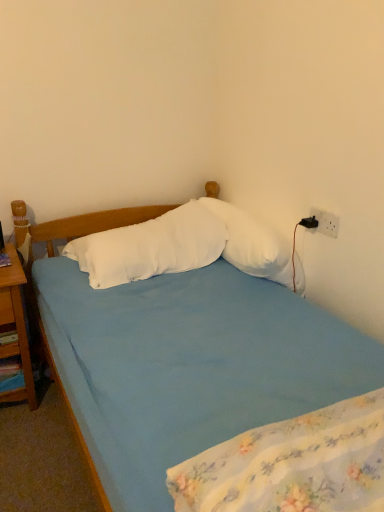
Question: Is white soft pillow at center, the first pillow in the right-to-left sequence, next to blue fabric mattress at lower center?

Choices:
 (A) no
 (B) yes

Answer: (A)

Question: Is white soft pillow at center, which is counted as the 2th pillow, starting from the left, further to camera compared to blue fabric mattress at lower center?

Choices:
 (A) no
 (B) yes

Answer: (B)

Question: Are white soft pillow at center, the first pillow in the right-to-left sequence, and blue fabric mattress at lower center located far from each other?

Choices:
 (A) yes
 (B) no

Answer: (B)

Question: Does white soft pillow at center, the first pillow in the right-to-left sequence, have a lesser width compared to blue fabric mattress at lower center?

Choices:
 (A) yes
 (B) no

Answer: (A)

Question: Is white soft pillow at center, which is counted as the 2th pillow, starting from the left, at the left side of blue fabric mattress at lower center?

Choices:
 (A) no
 (B) yes

Answer: (B)

Question: In terms of width, does white soft pillow at center, which ranks as the first pillow in left-to-right order, look wider or thinner when compared to white soft pillow at center, which is counted as the 2th pillow, starting from the left?

Choices:
 (A) thin
 (B) wide

Answer: (B)

Question: Do you think white soft pillow at center, arranged as the 2th pillow when viewed from the right, is within white soft pillow at center, which is counted as the 2th pillow, starting from the left, or outside of it?

Choices:
 (A) outside
 (B) inside

Answer: (A)

Question: In terms of height, does white soft pillow at center, which ranks as the first pillow in left-to-right order, look taller or shorter compared to white soft pillow at center, the first pillow in the right-to-left sequence?

Choices:
 (A) tall
 (B) short

Answer: (B)

Question: Based on their sizes in the image, would you say white soft pillow at center, which ranks as the first pillow in left-to-right order, is bigger or smaller than white soft pillow at center, the first pillow in the right-to-left sequence?

Choices:
 (A) small
 (B) big

Answer: (B)

Question: In terms of width, does blue fabric mattress at lower center look wider or thinner when compared to white soft pillow at center, which ranks as the first pillow in left-to-right order?

Choices:
 (A) thin
 (B) wide

Answer: (A)

Question: Relative to white soft pillow at center, which ranks as the first pillow in left-to-right order, is blue fabric mattress at lower center in front or behind?

Choices:
 (A) behind
 (B) front

Answer: (B)

Question: In the image, is blue fabric mattress at lower center on the left side or the right side of white soft pillow at center, arranged as the 2th pillow when viewed from the right?

Choices:
 (A) right
 (B) left

Answer: (A)

Question: From a real-world perspective, is blue fabric mattress at lower center positioned above or below white soft pillow at center, arranged as the 2th pillow when viewed from the right?

Choices:
 (A) above
 (B) below

Answer: (A)

Question: Is blue fabric mattress at lower center inside the boundaries of black plastic power outlet at upper right, or outside?

Choices:
 (A) inside
 (B) outside

Answer: (B)

Question: In terms of size, does blue fabric mattress at lower center appear bigger or smaller than black plastic power outlet at upper right?

Choices:
 (A) big
 (B) small

Answer: (A)